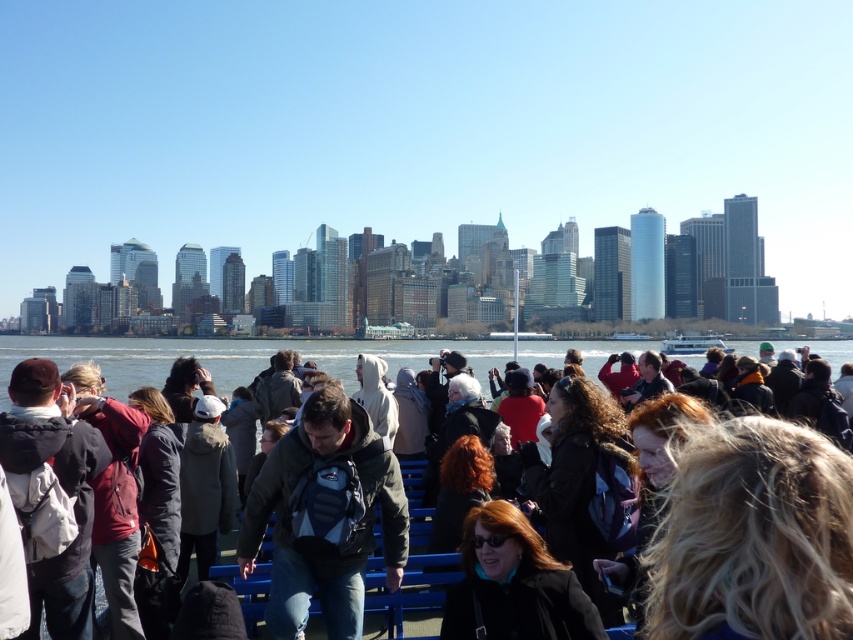
Who is lower down, clear water at center or matte black jacket at center?

matte black jacket at center is below.

What do you see at coordinates (230, 356) in the screenshot? The width and height of the screenshot is (853, 640). I see `clear water at center` at bounding box center [230, 356].

This screenshot has height=640, width=853. In order to click on clear water at center in this screenshot , I will do `click(230, 356)`.

Image resolution: width=853 pixels, height=640 pixels. I want to click on clear water at center, so [x=230, y=356].

Who is more forward, [561,435] or [119,452]?

Point [119,452]

Who is positioned more to the right, dark brown leather jacket at center or matte red jacket at left?

dark brown leather jacket at center is more to the right.

Locate an element on the screen. This screenshot has height=640, width=853. dark brown leather jacket at center is located at coordinates (577, 480).

Between dark gray backpack at left and matte black jacket at center, which one has less height?

matte black jacket at center is shorter.

Based on the photo, who is positioned more to the right, dark gray backpack at left or matte black jacket at center?

matte black jacket at center is more to the right.

The image size is (853, 640). What are the coordinates of `dark gray backpack at left` in the screenshot? It's located at (61, 486).